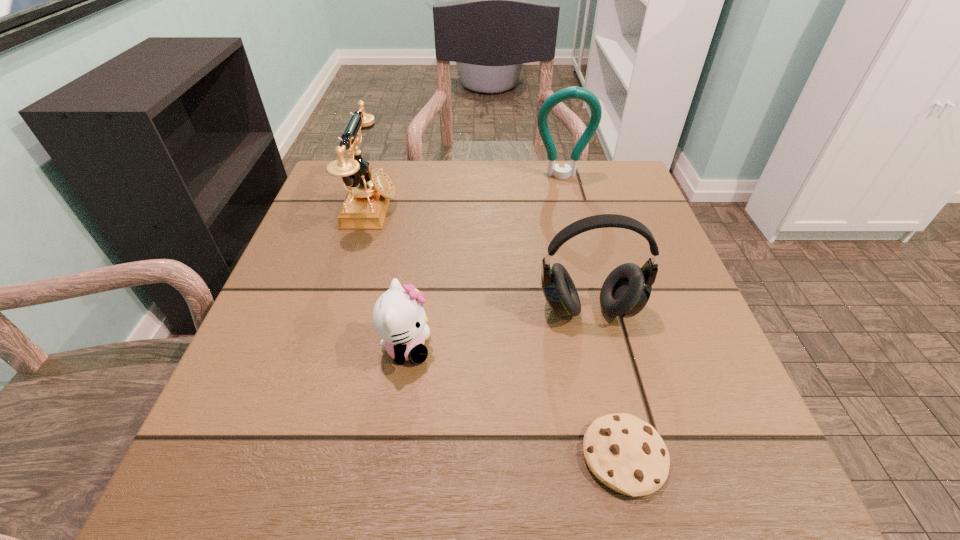
This screenshot has height=540, width=960. Find the location of `free space in the image that satisfies the following two spatial constraints: 1. at the jaws of the bottle opener; 2. on the front-facing side of the kitten`. free space in the image that satisfies the following two spatial constraints: 1. at the jaws of the bottle opener; 2. on the front-facing side of the kitten is located at coordinates (605, 348).

You are a GUI agent. You are given a task and a screenshot of the screen. Output one action in this format:
    pyautogui.click(x=<x>, y=<y>)
    Task: Click on the vacant area that satisfies the following two spatial constraints: 1. on the front-facing side of the fourth object from right to left; 2. on the back side of the nearest object
    Image resolution: width=960 pixels, height=540 pixels.
    Given the screenshot: What is the action you would take?
    pyautogui.click(x=391, y=456)

Locate an element on the screen. vacant area that satisfies the following two spatial constraints: 1. on the dial of the shortest object; 2. on the left side of the telephone is located at coordinates (x=297, y=456).

Image resolution: width=960 pixels, height=540 pixels. Identify the location of blank space that satisfies the following two spatial constraints: 1. on the ear cups of the nearest object; 2. on the left side of the headset. (624, 456).